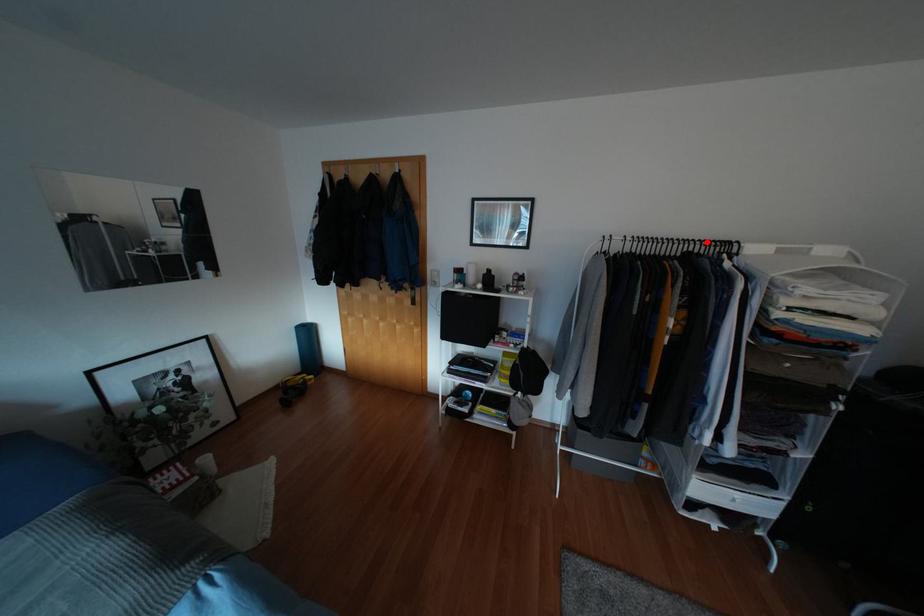
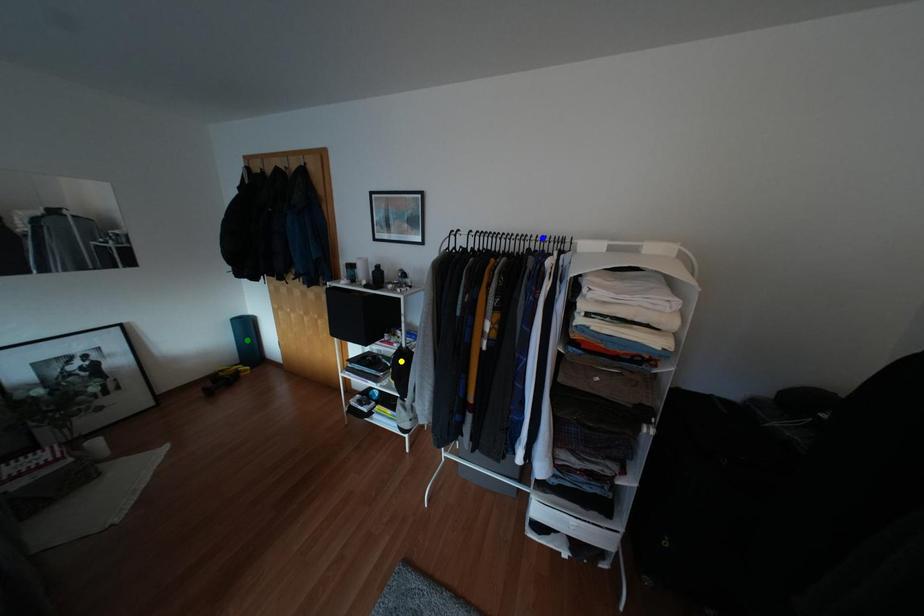
Question: I am providing you with two images of the same scene from different viewpoints. A red point is marked on the first image. You are given multiple points on the second image. Which mark in image 2 goes with the point in image 1?

Choices:
 (A) blue point
 (B) green point
 (C) yellow point

Answer: (A)